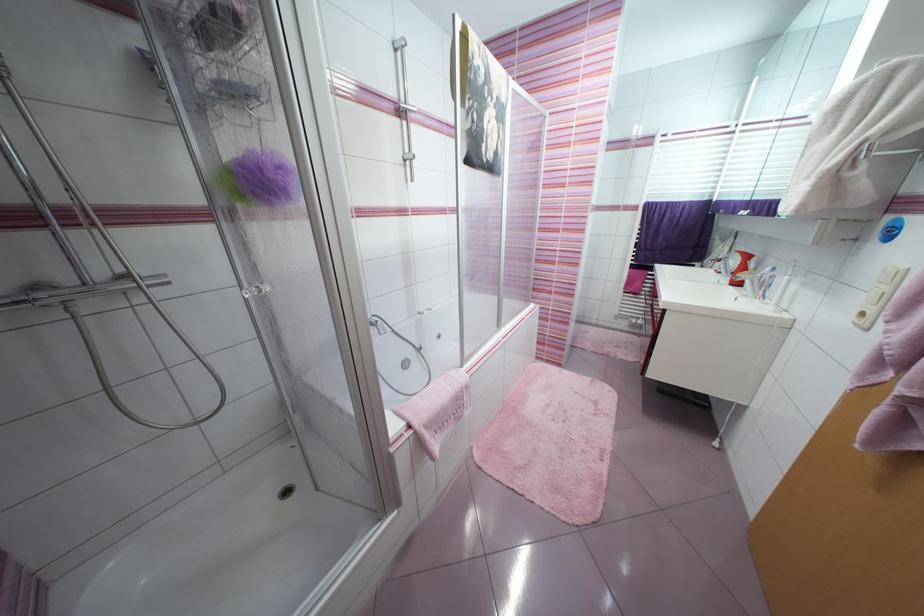
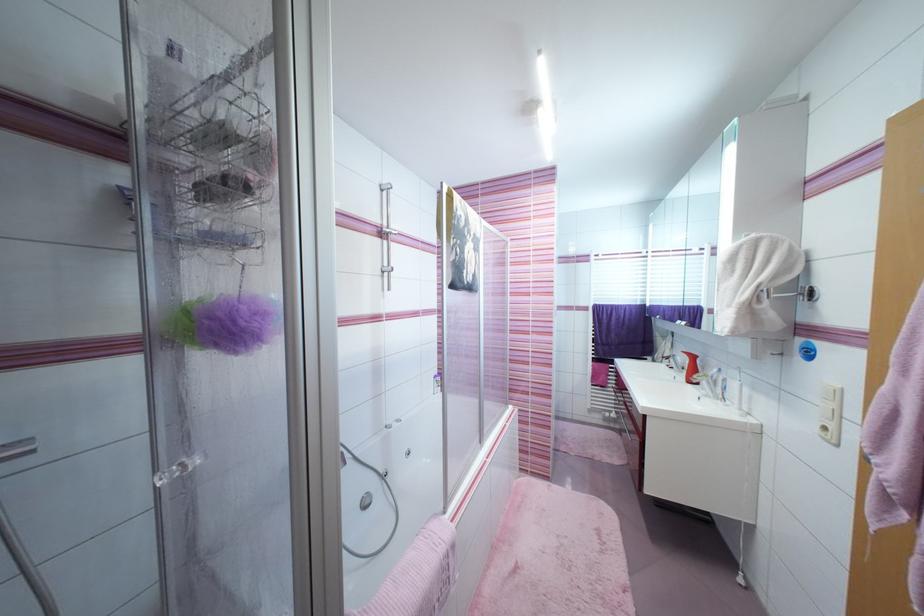
Find the pixel in the second image that matches pixel 777 278 in the first image.

(730, 381)